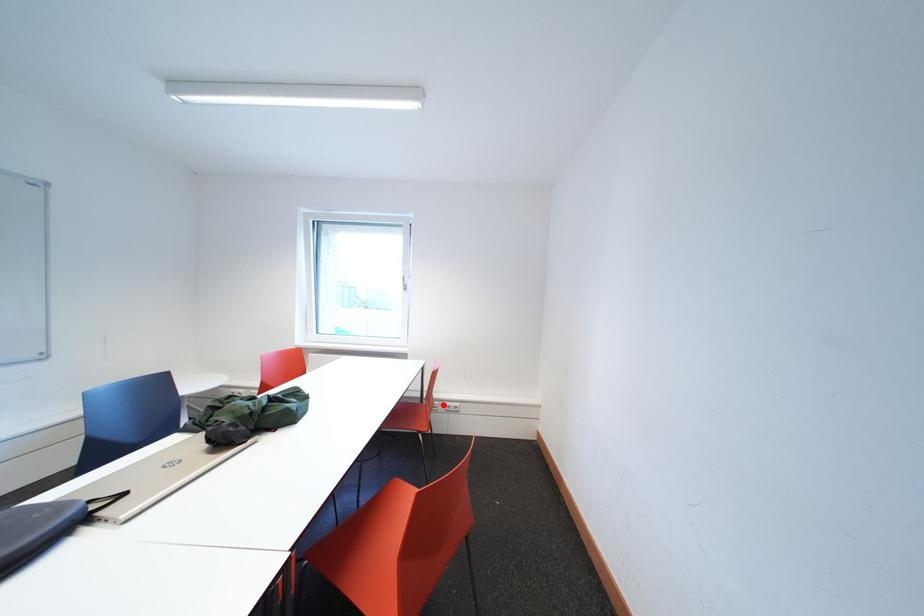
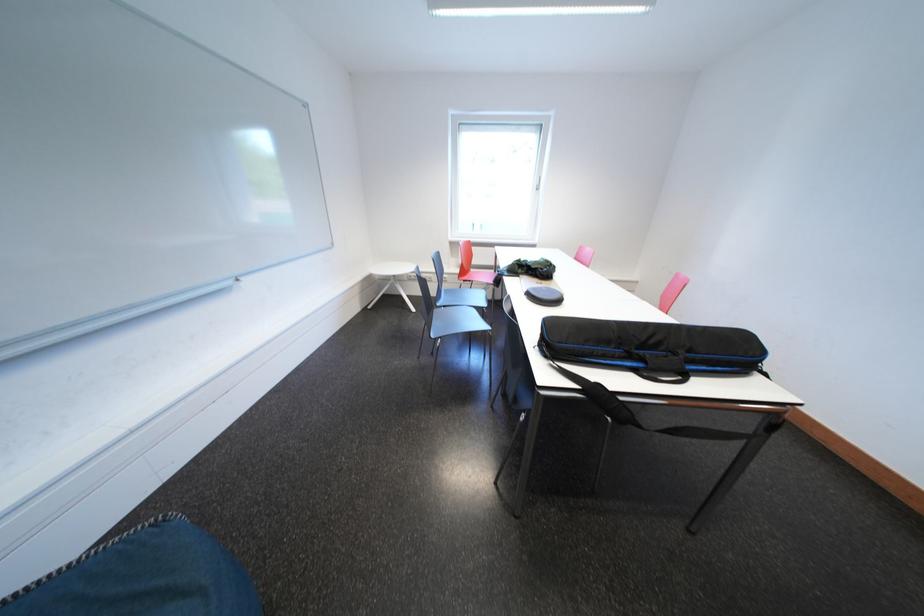
Question: I am providing you with two images of the same scene from different viewpoints. A red point is marked on the first image. Is the red point's position out of view in image 2?

Choices:
 (A) Yes
 (B) No

Answer: (A)